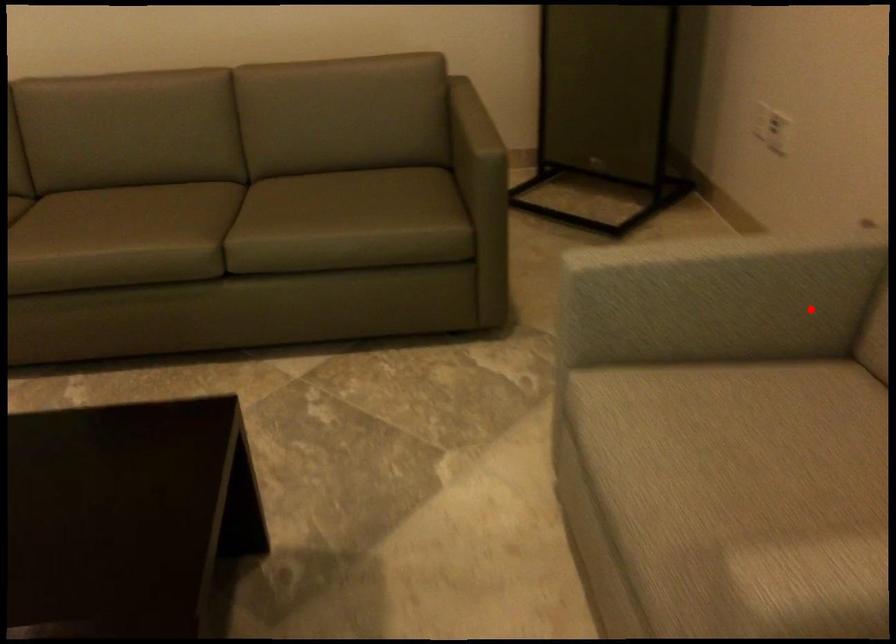
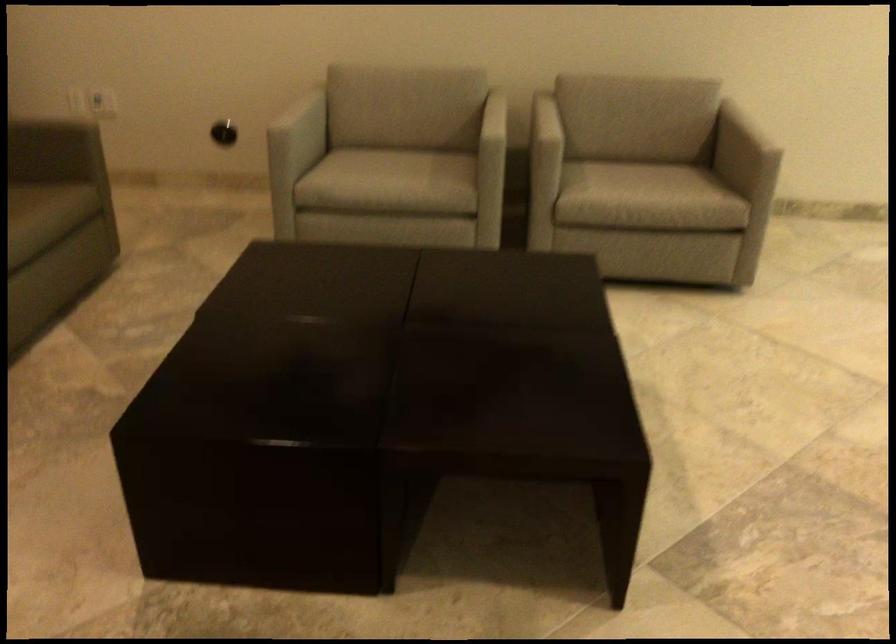
Question: A red point is marked in image1. In image2, is the corresponding 3D point closer to the camera or farther? Reply with the corresponding letter.

Choices:
 (A) The corresponding 3D point is closer.
 (B) The corresponding 3D point is farther.

Answer: (B)